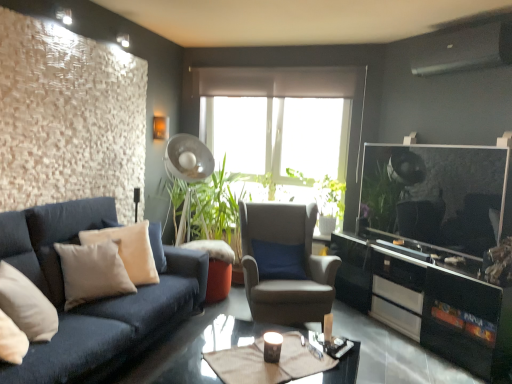
The height and width of the screenshot is (384, 512). Describe the element at coordinates (92, 272) in the screenshot. I see `beige velvet pillow at left, positioned as the 1th pillow in front-to-back order` at that location.

How much space does beige velvet pillow at left, which ranks as the 2th pillow in back-to-front order, occupy vertically?

It is 22.80 inches.

Describe the element at coordinates (268, 363) in the screenshot. Image resolution: width=512 pixels, height=384 pixels. I see `matte brown table at center` at that location.

Describe the element at coordinates (129, 249) in the screenshot. I see `beige fabric pillow at left, positioned as the second pillow in front-to-back order` at that location.

What is the approximate height of beige fabric pillow at left, the first pillow viewed from the back?

beige fabric pillow at left, the first pillow viewed from the back, is 24.68 inches tall.

The height and width of the screenshot is (384, 512). What do you see at coordinates (429, 302) in the screenshot? I see `black glossy cabinet at right` at bounding box center [429, 302].

What are the coordinates of `shiny black glass coffee table at center` in the screenshot? It's located at 213,349.

Is beige fabric pillow at left, the first pillow viewed from the back, wider than beige velvet pillow at left, which ranks as the 2th pillow in back-to-front order?

Incorrect, the width of beige fabric pillow at left, the first pillow viewed from the back, does not surpass that of beige velvet pillow at left, which ranks as the 2th pillow in back-to-front order.

Which is farther from the camera, [131,240] or [111,280]?

Positioned behind is point [131,240].

Is beige fabric pillow at left, the first pillow viewed from the back, placed right next to beige velvet pillow at left, positioned as the 1th pillow in front-to-back order?

No, beige fabric pillow at left, the first pillow viewed from the back, is not in contact with beige velvet pillow at left, positioned as the 1th pillow in front-to-back order.

Who is shorter, beige fabric pillow at left, positioned as the second pillow in front-to-back order, or beige velvet pillow at left, positioned as the 1th pillow in front-to-back order?

beige velvet pillow at left, positioned as the 1th pillow in front-to-back order, is shorter.

Is suede-like gray armchair at center thinner than shiny black glass coffee table at center?

Yes, suede-like gray armchair at center is thinner than shiny black glass coffee table at center.

From a real-world perspective, which object stands above the other?

suede-like gray armchair at center is physically above.

The height and width of the screenshot is (384, 512). Find the location of `chair on the right of shiny black glass coffee table at center`. chair on the right of shiny black glass coffee table at center is located at coordinates (285, 264).

Based on the photo, is shiny black glass coffee table at center located within suede-like gray armchair at center?

No, shiny black glass coffee table at center is not surrounded by suede-like gray armchair at center.

Which object is further away from the camera taking this photo, metallic silver fan at center or black glossy cabinet at right?

Positioned behind is metallic silver fan at center.

Can you confirm if metallic silver fan at center is thinner than black glossy cabinet at right?

Correct, the width of metallic silver fan at center is less than that of black glossy cabinet at right.

Can you see metallic silver fan at center touching black glossy cabinet at right?

There is a gap between metallic silver fan at center and black glossy cabinet at right.

Does point (196, 179) appear closer or farther from the camera than point (385, 309)?

Point (196, 179).

Is matte brown table at center oriented away from beige velvet pillow at left, positioned as the 1th pillow in front-to-back order?

That's not correct — matte brown table at center is not looking away from beige velvet pillow at left, positioned as the 1th pillow in front-to-back order.

Considering the sizes of objects matte brown table at center and beige velvet pillow at left, positioned as the 1th pillow in front-to-back order, in the image provided, who is wider, matte brown table at center or beige velvet pillow at left, positioned as the 1th pillow in front-to-back order,?

matte brown table at center.

Is there a large distance between matte brown table at center and beige velvet pillow at left, which ranks as the 2th pillow in back-to-front order?

That's right, there is a large distance between matte brown table at center and beige velvet pillow at left, which ranks as the 2th pillow in back-to-front order.

Is matte brown table at center not inside beige velvet pillow at left, which ranks as the 2th pillow in back-to-front order?

Yes.

Is metallic silver fan at center positioned with its back to beige fabric pillow at left, the first pillow viewed from the back?

metallic silver fan at center is not turned away from beige fabric pillow at left, the first pillow viewed from the back.

Measure the distance from metallic silver fan at center to beige fabric pillow at left, the first pillow viewed from the back.

metallic silver fan at center and beige fabric pillow at left, the first pillow viewed from the back, are 1.28 meters apart from each other.

Is metallic silver fan at center wider than beige fabric pillow at left, positioned as the second pillow in front-to-back order?

Indeed, metallic silver fan at center has a greater width compared to beige fabric pillow at left, positioned as the second pillow in front-to-back order.

Which object is positioned more to the right, metallic silver fan at center or beige fabric pillow at left, the first pillow viewed from the back?

Positioned to the right is metallic silver fan at center.

Are matte brown table at center and metallic silver fan at center making contact?

No, matte brown table at center is not with metallic silver fan at center.

Would you say matte brown table at center is to the left or to the right of metallic silver fan at center in the picture?

Clearly, matte brown table at center is on the right of metallic silver fan at center in the image.

Is matte brown table at center located outside metallic silver fan at center?

Yes.

From a real-world perspective, which object rests below the other?

matte brown table at center.

Based on the photo, considering the relative sizes of beige fabric pillow at left, the first pillow viewed from the back, and metallic silver fan at center in the image provided, is beige fabric pillow at left, the first pillow viewed from the back, bigger than metallic silver fan at center?

No.

Can you tell me how much beige fabric pillow at left, positioned as the second pillow in front-to-back order, and metallic silver fan at center differ in facing direction?

The angle between the facing direction of beige fabric pillow at left, positioned as the second pillow in front-to-back order, and the facing direction of metallic silver fan at center is 22.8 degrees.

From a real-world perspective, is beige fabric pillow at left, the first pillow viewed from the back, positioned under metallic silver fan at center based on gravity?

Yes, from a real-world perspective, beige fabric pillow at left, the first pillow viewed from the back, is beneath metallic silver fan at center.

Considering the relative positions of beige fabric pillow at left, positioned as the second pillow in front-to-back order, and metallic silver fan at center in the image provided, is beige fabric pillow at left, positioned as the second pillow in front-to-back order, to the right of metallic silver fan at center from the viewer's perspective?

No.

This screenshot has width=512, height=384. What are the coordinates of `pillow lying on the left of beige fabric pillow at left, positioned as the second pillow in front-to-back order` in the screenshot? It's located at (92, 272).

This screenshot has width=512, height=384. Identify the location of coffee table in front of the suede-like gray armchair at center. (213, 349).

Consider the image. From the image, which object appears to be nearer to beige fabric pillow at left, positioned as the second pillow in front-to-back order, beige velvet pillow at left, positioned as the 1th pillow in front-to-back order, or suede-like gray armchair at center?

Among the two, beige velvet pillow at left, positioned as the 1th pillow in front-to-back order, is located nearer to beige fabric pillow at left, positioned as the second pillow in front-to-back order.

Looking at the image, which one is located further to metallic silver fan at center, shiny black glass coffee table at center or beige fabric pillow at left, positioned as the second pillow in front-to-back order?

shiny black glass coffee table at center.

Which object lies further to the anchor point suede-like gray armchair at center, black glossy cabinet at right or beige fabric pillow at left, the first pillow viewed from the back?

The object further to suede-like gray armchair at center is beige fabric pillow at left, the first pillow viewed from the back.

Which object lies further to the anchor point metallic silver fan at center, beige velvet pillow at left, which ranks as the 2th pillow in back-to-front order, or suede-like gray armchair at center?

beige velvet pillow at left, which ranks as the 2th pillow in back-to-front order, is positioned further to the anchor metallic silver fan at center.

When comparing their distances from black glossy cabinet at right, does metallic silver fan at center or suede-like gray armchair at center seem closer?

suede-like gray armchair at center is positioned closer to the anchor black glossy cabinet at right.

Considering their positions, is suede-like gray armchair at center positioned further to beige fabric pillow at left, positioned as the second pillow in front-to-back order, than matte brown table at center?

matte brown table at center is positioned further to the anchor beige fabric pillow at left, positioned as the second pillow in front-to-back order.

Estimate the real-world distances between objects in this image. Which object is closer to shiny black glass coffee table at center, metallic silver fan at center or beige velvet pillow at left, which ranks as the 2th pillow in back-to-front order?

beige velvet pillow at left, which ranks as the 2th pillow in back-to-front order, lies closer to shiny black glass coffee table at center than the other object.

Considering their positions, is matte brown table at center positioned closer to shiny black glass coffee table at center than beige velvet pillow at left, which ranks as the 2th pillow in back-to-front order?

matte brown table at center lies closer to shiny black glass coffee table at center than the other object.

Identify the location of coffee table located between beige velvet pillow at left, positioned as the 1th pillow in front-to-back order, and black glossy cabinet at right in the left-right direction. This screenshot has height=384, width=512. (213, 349).

You are a GUI agent. You are given a task and a screenshot of the screen. Output one action in this format:
    pyautogui.click(x=<x>, y=<y>)
    Task: Click on the cabinetry between shiny black glass coffee table at center and metallic silver fan at center from front to back
    The height and width of the screenshot is (384, 512).
    Given the screenshot: What is the action you would take?
    pyautogui.click(x=429, y=302)

In order to click on fan located between beige fabric pillow at left, the first pillow viewed from the back, and black glossy cabinet at right in the left-right direction in this screenshot , I will do `click(187, 168)`.

This screenshot has height=384, width=512. I want to click on cocktail table located between beige velvet pillow at left, which ranks as the 2th pillow in back-to-front order, and suede-like gray armchair at center in the left-right direction, so click(268, 363).